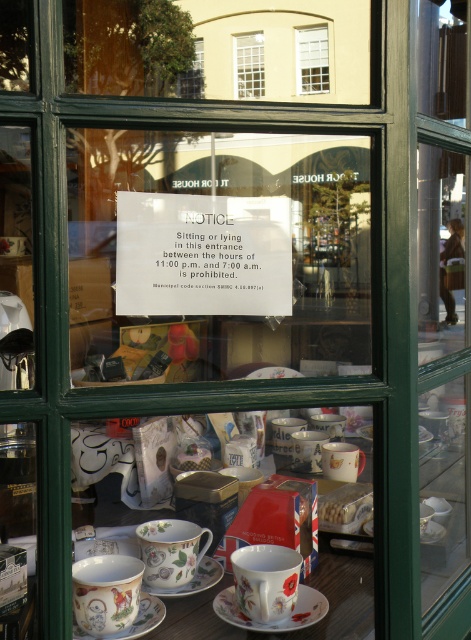
Which is more to the right, porcelain floral teacup at center or white glass window at upper center?

white glass window at upper center

Does porcelain floral teacup at center have a greater width compared to white glass window at upper center?

Indeed, porcelain floral teacup at center has a greater width compared to white glass window at upper center.

What do you see at coordinates (170, 550) in the screenshot? This screenshot has height=640, width=471. I see `porcelain floral teacup at center` at bounding box center [170, 550].

This screenshot has width=471, height=640. I want to click on porcelain floral teacup at center, so click(x=170, y=550).

Is porcelain floral teacup at center above transparent glass window at upper center?

No.

Does porcelain floral teacup at center come in front of transparent glass window at upper center?

That is True.

Which is in front, point (203, 552) or point (203, 61)?

Point (203, 552)

Identify the location of porcelain floral teacup at center. This screenshot has height=640, width=471. point(170,550).

Does floral porcelain teacup at lower center lie behind porcelain saucer at center?

No, floral porcelain teacup at lower center is closer to the viewer.

Who is more forward, (266, 584) or (226, 600)?

Point (266, 584) is more forward.

Is point (243, 588) closer to viewer compared to point (307, 618)?

That is True.

Locate an element on the screen. This screenshot has width=471, height=640. floral porcelain teacup at lower center is located at coordinates (266, 580).